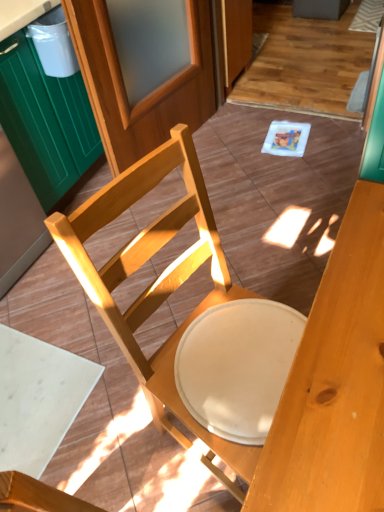
What are the coordinates of `green wood cabinet at left` in the screenshot? It's located at (45, 120).

Describe the element at coordinates (54, 44) in the screenshot. I see `white plastic trash bin at upper left` at that location.

Find the location of a particular element. wooden screen door at upper center is located at coordinates (151, 91).

This screenshot has height=512, width=384. What do you see at coordinates (151, 91) in the screenshot?
I see `wooden screen door at upper center` at bounding box center [151, 91].

This screenshot has width=384, height=512. I want to click on green wood cabinet at left, so click(x=45, y=120).

Is green wood cabinet at left located within wooden chair at center?

No, green wood cabinet at left is not inside wooden chair at center.

Could you tell me if wooden chair at center is facing green wood cabinet at left?

No, wooden chair at center is not aimed at green wood cabinet at left.

Is point (154, 289) closer or farther from the camera than point (61, 83)?

Point (154, 289) is positioned closer to the camera compared to point (61, 83).

Considering the sizes of objects wooden chair at center and green wood cabinet at left in the image provided, who is wider, wooden chair at center or green wood cabinet at left?

green wood cabinet at left is wider.

Which is farther, (33, 74) or (62, 62)?

The point (62, 62) is more distant.

Is the position of green wood cabinet at left more distant than that of white plastic trash bin at upper left?

No, green wood cabinet at left is closer to the camera.

Is green wood cabinet at left oriented away from white plastic trash bin at upper left?

No, green wood cabinet at left is not facing away from white plastic trash bin at upper left.

From the image's perspective, is green wood cabinet at left below white plastic trash bin at upper left?

Correct, green wood cabinet at left appears lower than white plastic trash bin at upper left in the image.

Is green wood cabinet at left far from wooden screen door at upper center?

Actually, green wood cabinet at left and wooden screen door at upper center are a little close together.

Between green wood cabinet at left and wooden screen door at upper center, which one has more height?

Standing taller between the two is wooden screen door at upper center.

Which is correct: green wood cabinet at left is inside wooden screen door at upper center, or outside of it?

green wood cabinet at left is located beyond the bounds of wooden screen door at upper center.

Looking at this image, which of these two, green wood cabinet at left or wooden screen door at upper center, is bigger?

Bigger between the two is green wood cabinet at left.

Looking at their sizes, would you say wooden screen door at upper center is wider or thinner than wooden chair at center?

In the image, wooden screen door at upper center appears to be more narrow than wooden chair at center.

Based on their positions, is wooden screen door at upper center located to the left or right of wooden chair at center?

Clearly, wooden screen door at upper center is on the left of wooden chair at center in the image.

Is wooden chair at center at the back of wooden screen door at upper center?

No, wooden screen door at upper center is not facing the opposite direction of wooden chair at center.

From the image's perspective, which one is positioned higher, wooden screen door at upper center or wooden chair at center?

From the image's view, wooden screen door at upper center is above.

Considering the relative sizes of wooden screen door at upper center and white plastic trash bin at upper left in the image provided, is wooden screen door at upper center bigger than white plastic trash bin at upper left?

Yes.

Which object is thinner, wooden screen door at upper center or white plastic trash bin at upper left?

white plastic trash bin at upper left.

Is wooden screen door at upper center located outside white plastic trash bin at upper left?

That's correct, wooden screen door at upper center is outside of white plastic trash bin at upper left.

Which is in front, point (190, 81) or point (43, 61)?

Positioned in front is point (43, 61).

In the scene shown: Is wooden screen door at upper center facing towards green wood cabinet at left?

No, wooden screen door at upper center is not facing towards green wood cabinet at left.

Image resolution: width=384 pixels, height=512 pixels. I want to click on screen door behind the green wood cabinet at left, so click(x=151, y=91).

Who is taller, wooden screen door at upper center or green wood cabinet at left?

→ With more height is wooden screen door at upper center.

Is the position of wooden screen door at upper center more distant than that of green wood cabinet at left?

Yes.

How far apart are white plastic trash bin at upper left and wooden screen door at upper center?

The distance of white plastic trash bin at upper left from wooden screen door at upper center is 37.14 centimeters.

What's the angular difference between white plastic trash bin at upper left and wooden screen door at upper center's facing directions?

The angular difference between white plastic trash bin at upper left and wooden screen door at upper center is 0.458 degrees.

From the image's perspective, who appears lower, white plastic trash bin at upper left or wooden screen door at upper center?

white plastic trash bin at upper left appears lower in the image.

Identify the location of screen door in front of the white plastic trash bin at upper left. (151, 91).

Find the location of `cabinetry located on the left of wooden chair at center`. cabinetry located on the left of wooden chair at center is located at coordinates (45, 120).

You are a GUI agent. You are given a task and a screenshot of the screen. Output one action in this format:
    pyautogui.click(x=<x>, y=<y>)
    Task: Click on the cabinetry located in front of the white plastic trash bin at upper left
    The width and height of the screenshot is (384, 512).
    Given the screenshot: What is the action you would take?
    pyautogui.click(x=45, y=120)

From the image, which object appears to be nearer to white plastic trash bin at upper left, wooden screen door at upper center or green wood cabinet at left?

Among the two, green wood cabinet at left is located nearer to white plastic trash bin at upper left.

Which object lies nearer to the anchor point wooden chair at center, wooden screen door at upper center or white plastic trash bin at upper left?

white plastic trash bin at upper left is positioned closer to the anchor wooden chair at center.

Which object lies nearer to the anchor point white plastic trash bin at upper left, wooden screen door at upper center or wooden chair at center?

Based on the image, wooden screen door at upper center appears to be nearer to white plastic trash bin at upper left.

When comparing their distances from wooden screen door at upper center, does green wood cabinet at left or wooden chair at center seem further?

wooden chair at center lies further to wooden screen door at upper center than the other object.

Based on their spatial positions, is green wood cabinet at left or white plastic trash bin at upper left closer to wooden screen door at upper center?

green wood cabinet at left is positioned closer to the anchor wooden screen door at upper center.

Looking at the image, which one is located closer to white plastic trash bin at upper left, wooden chair at center or green wood cabinet at left?

green wood cabinet at left.

Based on their spatial positions, is green wood cabinet at left or wooden screen door at upper center further from white plastic trash bin at upper left?

Among the two, wooden screen door at upper center is located further to white plastic trash bin at upper left.

Considering their positions, is wooden screen door at upper center positioned further to wooden chair at center than green wood cabinet at left?

wooden screen door at upper center is further to wooden chair at center.

You are a GUI agent. You are given a task and a screenshot of the screen. Output one action in this format:
    pyautogui.click(x=<x>, y=<y>)
    Task: Click on the trash bin/can between green wood cabinet at left and wooden screen door at upper center from left to right
    The image size is (384, 512).
    Given the screenshot: What is the action you would take?
    pyautogui.click(x=54, y=44)

At what (x,y) coordinates should I click in order to perform the action: click on trash bin/can between wooden screen door at upper center and wooden chair at center in the up-down direction. Please return your answer as a coordinate pair (x, y). The height and width of the screenshot is (512, 384). Looking at the image, I should click on (54, 44).

Identify the location of cabinetry between white plastic trash bin at upper left and wooden chair at center in the up-down direction. (45, 120).

Locate an element on the screen. The width and height of the screenshot is (384, 512). cabinetry between wooden screen door at upper center and wooden chair at center in the up-down direction is located at coordinates (45, 120).